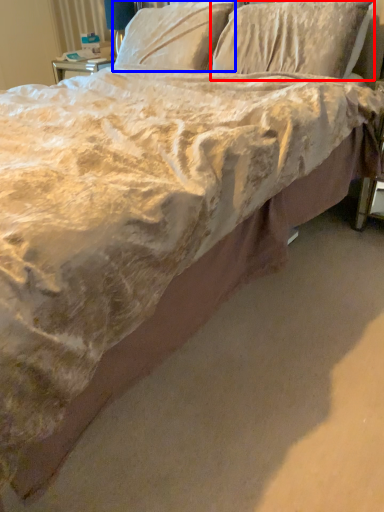
Question: Which object is further to the camera taking this photo, pillow (highlighted by a red box) or pillow (highlighted by a blue box)?

Choices:
 (A) pillow
 (B) pillow

Answer: (B)